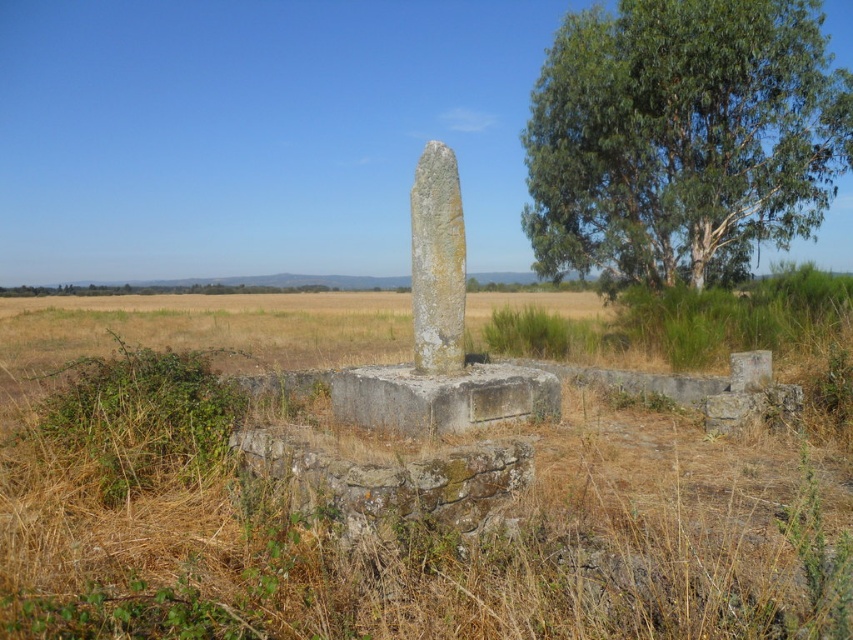
Question: Considering the real-world distances, which object is closest to the gray stone pillar at center?

Choices:
 (A) brown dry grass at center
 (B) gray stone monument at center

Answer: (B)

Question: Which point is farther to the camera?

Choices:
 (A) brown dry grass at center
 (B) green leafy tree at upper right

Answer: (B)

Question: Can you confirm if brown dry grass at center is bigger than gray stone monument at center?

Choices:
 (A) yes
 (B) no

Answer: (A)

Question: Estimate the real-world distances between objects in this image. Which object is farther from the gray stone pillar at center?

Choices:
 (A) gray stone monument at center
 (B) green leafy tree at upper right

Answer: (B)

Question: Does green leafy tree at upper right appear on the left side of gray stone pillar at center?

Choices:
 (A) no
 (B) yes

Answer: (A)

Question: Does gray stone monument at center come behind gray stone pillar at center?

Choices:
 (A) yes
 (B) no

Answer: (A)